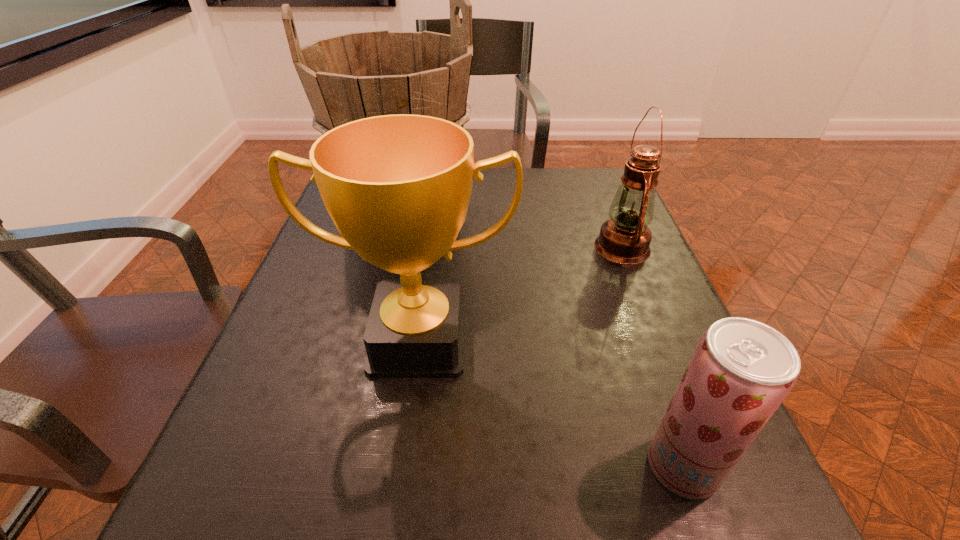
The width and height of the screenshot is (960, 540). In the image, there is a desktop. Find the location of `vacant space at the near left corner`. vacant space at the near left corner is located at coordinates (270, 514).

Locate an element on the screen. vacant area at the far right corner is located at coordinates (568, 167).

This screenshot has width=960, height=540. I want to click on vacant region between the third farthest object and the fruit juice, so click(x=551, y=403).

Locate an element on the screen. This screenshot has width=960, height=540. free space between the second shortest object and the tallest object is located at coordinates (514, 228).

Locate an element on the screen. free space between the award and the oil lamp is located at coordinates (520, 293).

You are a GUI agent. You are given a task and a screenshot of the screen. Output one action in this format:
    pyautogui.click(x=<x>, y=<y>)
    Task: Click on the empty space between the nearest object and the bucket
    The height and width of the screenshot is (540, 960).
    Given the screenshot: What is the action you would take?
    pyautogui.click(x=543, y=338)

Where is `unoccupied area between the nearest object and the tallest object`? unoccupied area between the nearest object and the tallest object is located at coordinates (543, 338).

Find the location of a particular element. This screenshot has width=960, height=540. free space between the third tallest object and the bucket is located at coordinates (514, 228).

Find the location of a particular element. The height and width of the screenshot is (540, 960). unoccupied position between the oil lamp and the shortest object is located at coordinates (653, 356).

Locate an element on the screen. The image size is (960, 540). empty space that is in between the award and the fruit juice is located at coordinates (551, 403).